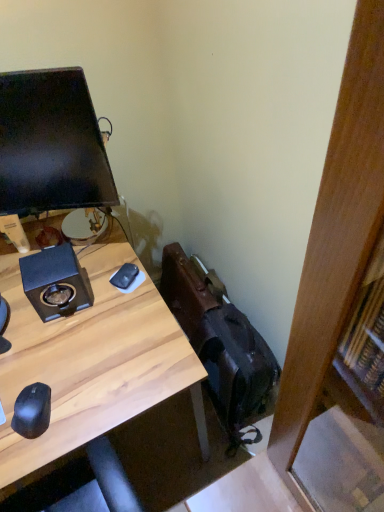
The width and height of the screenshot is (384, 512). Identify the location of empty space that is to the right of black matte mouse at lower left, which is the first mouse from bottom to top. (92, 401).